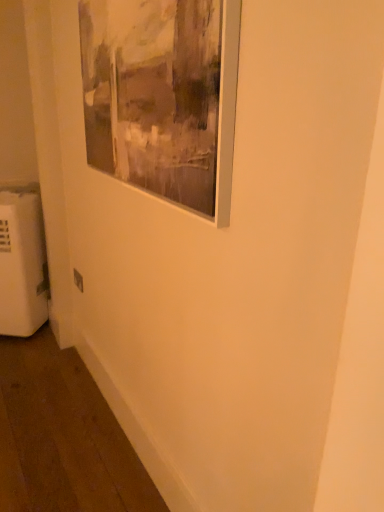
Question: Does white plastic radiator at lower left lie behind matte silver picture frame at upper left?

Choices:
 (A) yes
 (B) no

Answer: (A)

Question: Considering the relative sizes of white plastic radiator at lower left and matte silver picture frame at upper left in the image provided, is white plastic radiator at lower left wider than matte silver picture frame at upper left?

Choices:
 (A) yes
 (B) no

Answer: (A)

Question: From the image's perspective, is white plastic radiator at lower left under matte silver picture frame at upper left?

Choices:
 (A) yes
 (B) no

Answer: (A)

Question: Is white plastic radiator at lower left closer to camera compared to matte silver picture frame at upper left?

Choices:
 (A) no
 (B) yes

Answer: (A)

Question: Is white plastic radiator at lower left smaller than matte silver picture frame at upper left?

Choices:
 (A) no
 (B) yes

Answer: (A)

Question: Does point (81, 281) appear closer or farther from the camera than point (155, 151)?

Choices:
 (A) closer
 (B) farther

Answer: (B)

Question: From a real-world perspective, relative to matte silver picture frame at upper left, is white plastic electric outlet at lower left vertically above or below?

Choices:
 (A) above
 (B) below

Answer: (B)

Question: From their relative heights in the image, would you say white plastic electric outlet at lower left is taller or shorter than matte silver picture frame at upper left?

Choices:
 (A) tall
 (B) short

Answer: (B)

Question: Is white plastic electric outlet at lower left spatially inside matte silver picture frame at upper left, or outside of it?

Choices:
 (A) inside
 (B) outside

Answer: (B)

Question: Considering the positions of matte silver picture frame at upper left and white plastic radiator at lower left in the image, is matte silver picture frame at upper left wider or thinner than white plastic radiator at lower left?

Choices:
 (A) thin
 (B) wide

Answer: (A)

Question: From the image's perspective, is matte silver picture frame at upper left positioned above or below white plastic radiator at lower left?

Choices:
 (A) above
 (B) below

Answer: (A)

Question: Looking at the image, does matte silver picture frame at upper left seem bigger or smaller compared to white plastic radiator at lower left?

Choices:
 (A) big
 (B) small

Answer: (B)

Question: Considering the positions of matte silver picture frame at upper left and white plastic radiator at lower left in the image, is matte silver picture frame at upper left taller or shorter than white plastic radiator at lower left?

Choices:
 (A) short
 (B) tall

Answer: (A)

Question: Considering the positions of point (72, 267) and point (26, 328), is point (72, 267) closer or farther from the camera than point (26, 328)?

Choices:
 (A) closer
 (B) farther

Answer: (A)

Question: Is white plastic electric outlet at lower left to the left or to the right of white plastic radiator at lower left in the image?

Choices:
 (A) left
 (B) right

Answer: (B)